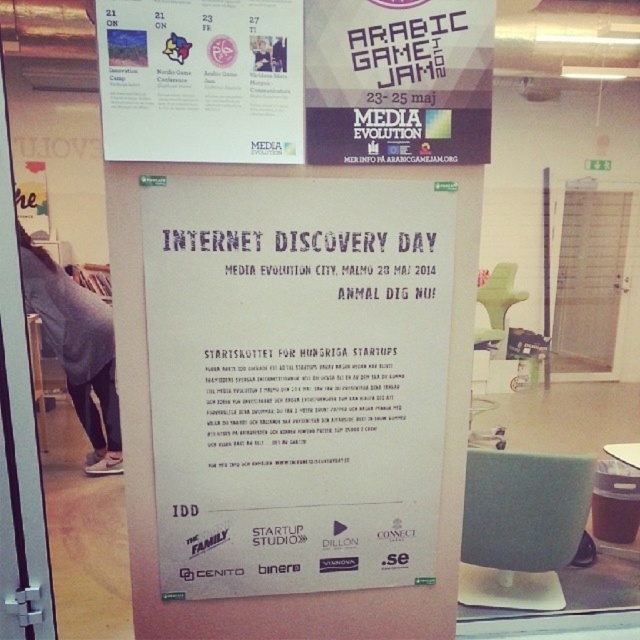
The image size is (640, 640). I want to click on white paper poster at upper center, so click(x=202, y=81).

Can you confirm if white paper poster at upper center is bigger than matte white sign at upper center?

Yes.

Who is more forward, (202, 150) or (472, 84)?

Point (202, 150) is in front.

Locate an element on the screen. The image size is (640, 640). white paper poster at upper center is located at coordinates (202, 81).

Can you confirm if white paper poster at center is shorter than matte white sign at upper center?

No.

Looking at this image, is white paper poster at center to the right of matte white sign at upper center from the viewer's perspective?

No, white paper poster at center is not to the right of matte white sign at upper center.

Identify the location of white paper poster at center. (296, 380).

I want to click on white paper poster at center, so click(x=296, y=380).

Does point (372, 451) come farther from viewer compared to point (209, 3)?

Yes, it is behind point (209, 3).

Is white paper poster at center positioned in front of white paper poster at upper center?

No, it is behind white paper poster at upper center.

Identify the location of white paper poster at center. (296, 380).